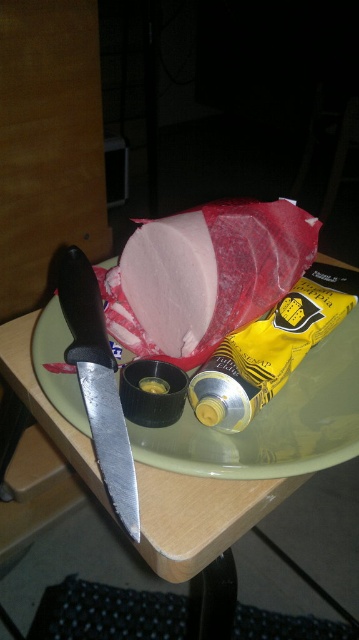
Is the position of pink smooth ham at center less distant than that of green matte plate at center?

That is False.

Does pink smooth ham at center have a lesser width compared to green matte plate at center?

Yes, pink smooth ham at center is thinner than green matte plate at center.

Where is `pink smooth ham at center`? This screenshot has height=640, width=359. pink smooth ham at center is located at coordinates (211, 273).

Locate an element on the screen. The width and height of the screenshot is (359, 640). pink smooth ham at center is located at coordinates (211, 273).

Consider the image. Is pink smooth ham at center shorter than polished silver knife at left?

Correct, pink smooth ham at center is not as tall as polished silver knife at left.

In the scene shown: Is pink smooth ham at center closer to camera compared to polished silver knife at left?

No, pink smooth ham at center is further to the viewer.

Who is more distant from viewer, (156, 326) or (101, 358)?

Positioned behind is point (156, 326).

Where is `pink smooth ham at center`? The height and width of the screenshot is (640, 359). pink smooth ham at center is located at coordinates (211, 273).

Is green matte plate at center closer to camera compared to polished silver knife at left?

That is False.

Does green matte plate at center have a greater height compared to polished silver knife at left?

No, green matte plate at center is not taller than polished silver knife at left.

Which is behind, point (338, 378) or point (85, 353)?

The point (338, 378) is behind.

Where is `green matte plate at center`? Image resolution: width=359 pixels, height=640 pixels. green matte plate at center is located at coordinates (273, 422).